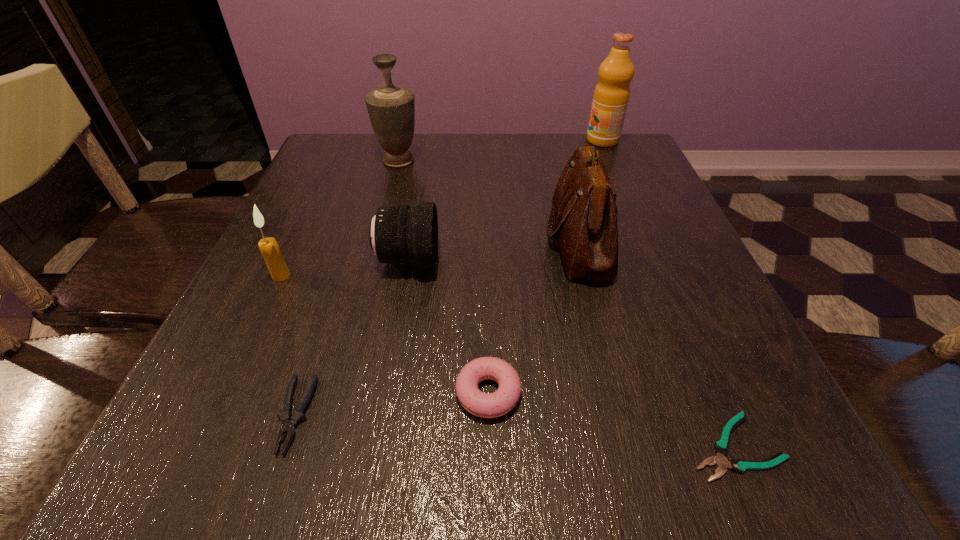
Find the location of a particular element. The image size is (960, 540). free spot between the shortest object and the left pliers is located at coordinates (515, 430).

Locate an element on the screen. free space that is in between the shortest object and the fourth object from right to left is located at coordinates (611, 420).

At what (x,y) coordinates should I click in order to perform the action: click on vacant area between the fruit juice and the fifth shortest object. Please return your answer as a coordinate pair (x, y). Looking at the image, I should click on (442, 208).

Image resolution: width=960 pixels, height=540 pixels. What are the coordinates of `free spot between the shortest object and the seventh tallest object` in the screenshot? It's located at (515, 430).

Locate an element on the screen. The width and height of the screenshot is (960, 540). vacant space that is in between the shoulder bag and the shorter pliers is located at coordinates (x=657, y=343).

The width and height of the screenshot is (960, 540). I want to click on vacant area that lies between the left pliers and the shortest object, so click(515, 430).

Locate an element on the screen. The width and height of the screenshot is (960, 540). free space between the doughnut and the third object from right to left is located at coordinates (534, 316).

The image size is (960, 540). Identify the location of vacant area that lies between the fifth shortest object and the second farthest object. (340, 218).

This screenshot has height=540, width=960. I want to click on vacant space that's between the fruit juice and the urn, so click(500, 151).

Locate an element on the screen. The image size is (960, 540). object that ranks as the fourth closest to the fruit juice is located at coordinates (486, 405).